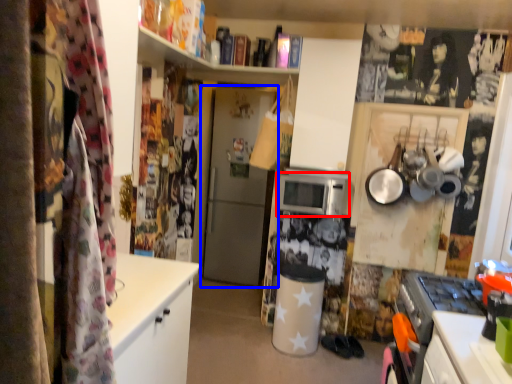
Question: Which object appears farthest to the camera in this image, microwave oven (highlighted by a red box) or door (highlighted by a blue box)?

Choices:
 (A) microwave oven
 (B) door

Answer: (B)